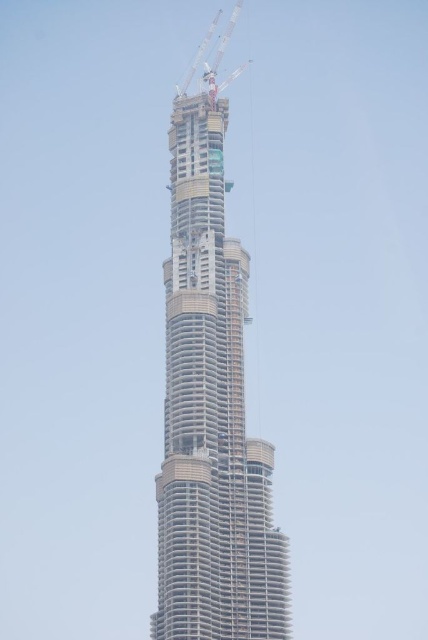
Which of these two, beige concrete tower at center or white metallic crane at upper center, stands taller?

beige concrete tower at center is taller.

Who is higher up, beige concrete tower at center or white metallic crane at upper center?

Positioned higher is white metallic crane at upper center.

Does point (234, 300) come closer to viewer compared to point (237, 13)?

That is True.

You are a GUI agent. You are given a task and a screenshot of the screen. Output one action in this format:
    pyautogui.click(x=<x>, y=<y>)
    Task: Click on the beige concrete tower at center
    
    Given the screenshot: What is the action you would take?
    pyautogui.click(x=211, y=416)